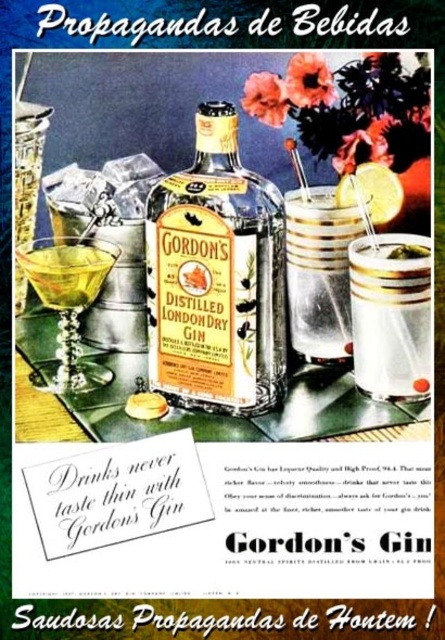
Question: Is clear glass cocktail at center to the left of shiny gold martini glass at lower left from the viewer's perspective?

Choices:
 (A) yes
 (B) no

Answer: (B)

Question: Which of the following is the farthest from the observer?

Choices:
 (A) (261, 358)
 (B) (393, 337)

Answer: (B)

Question: Is the position of matte glass bottle at center less distant than that of clear plastic cup at center?

Choices:
 (A) no
 (B) yes

Answer: (B)

Question: Estimate the real-world distances between objects in this image. Which object is farther from the matte glass bottle at center?

Choices:
 (A) clear plastic cup at center
 (B) yellow matte lemon at upper right
 (C) clear glass cocktail at center
 (D) shiny gold martini glass at lower left

Answer: (B)

Question: Estimate the real-world distances between objects in this image. Which object is farther from the clear plastic cup at center?

Choices:
 (A) matte glass bottle at center
 (B) clear glass cocktail at center

Answer: (A)

Question: Can you confirm if shiny gold martini glass at lower left is smaller than yellow matte lemon at upper right?

Choices:
 (A) no
 (B) yes

Answer: (A)